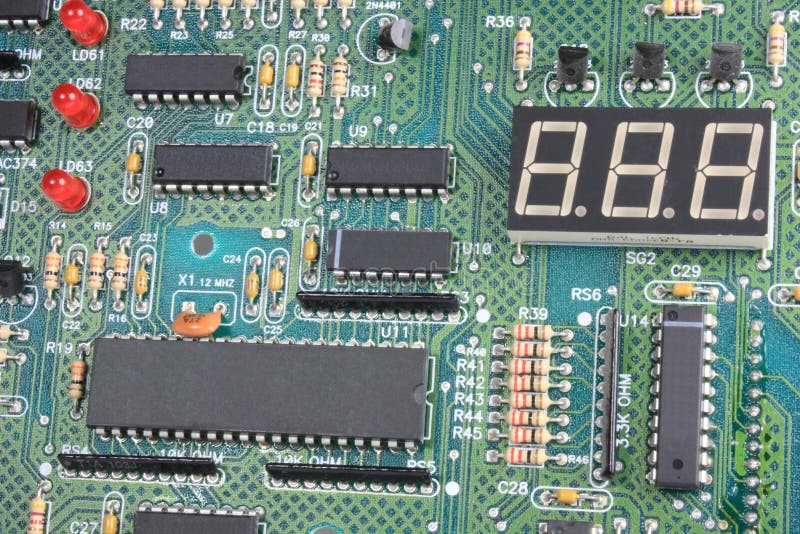
In order to click on thin black plug area in this screenshot , I will do `click(392, 300)`, `click(358, 467)`, `click(112, 459)`.